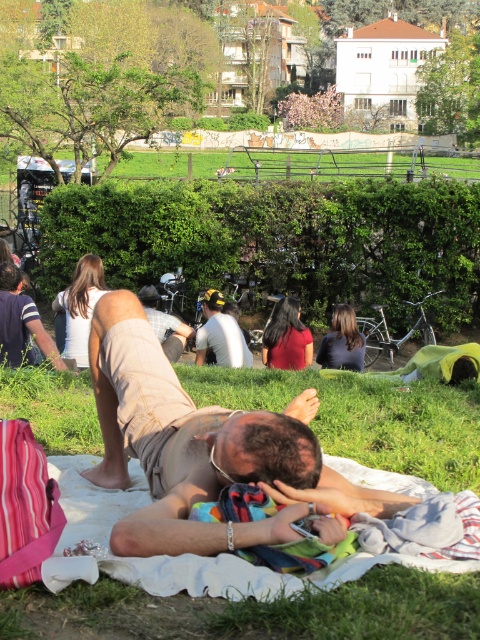
Question: Does tan cotton shorts at lower center have a smaller size compared to white matte shirt at center?

Choices:
 (A) yes
 (B) no

Answer: (B)

Question: Which of the following is the farthest from the observer?

Choices:
 (A) (190, 470)
 (B) (244, 356)

Answer: (B)

Question: Is tan cotton shorts at lower center smaller than white matte shirt at center?

Choices:
 (A) no
 (B) yes

Answer: (A)

Question: Which point is closer to the camera taking this photo?

Choices:
 (A) (292, 481)
 (B) (212, 314)

Answer: (A)

Question: Can you confirm if tan cotton shorts at lower center is positioned below white matte shirt at center?

Choices:
 (A) no
 (B) yes

Answer: (B)